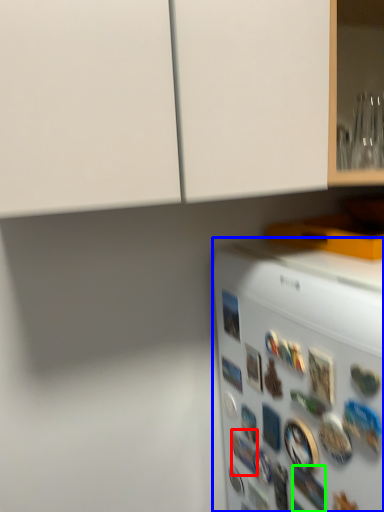
Question: Which is nearer to the button (highlighted by a red box)? refrigerator (highlighted by a blue box) or button (highlighted by a green box).

Choices:
 (A) refrigerator
 (B) button

Answer: (B)